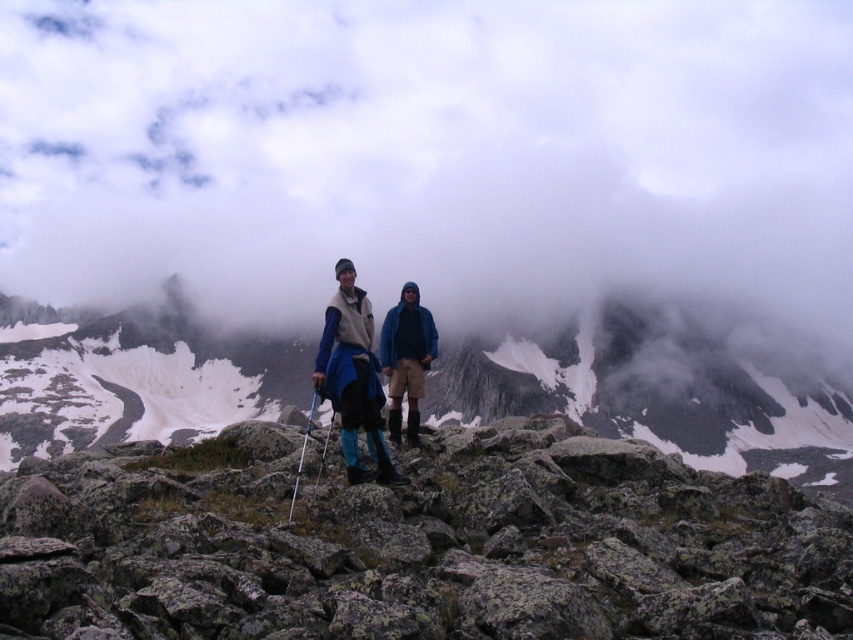
Question: Can you confirm if gray rock at center is smaller than rocky mountain at center?

Choices:
 (A) yes
 (B) no

Answer: (A)

Question: Is white fluffy cloud at upper center further to camera compared to blue fleece jacket at center?

Choices:
 (A) yes
 (B) no

Answer: (A)

Question: Which of these objects is positioned closest to the rocky mountain at center?

Choices:
 (A) gray rock at center
 (B) blue fleece jacket at center

Answer: (B)

Question: Which object is the closest to the rocky mountain at center?

Choices:
 (A) white fluffy cloud at upper center
 (B) blue fleece jacket at center

Answer: (A)

Question: Is rocky mountain at center further to camera compared to blue fleece jacket at center?

Choices:
 (A) no
 (B) yes

Answer: (B)

Question: Estimate the real-world distances between objects in this image. Which object is closer to the blue fleece jacket at center?

Choices:
 (A) gray rock at center
 (B) white fluffy cloud at upper center

Answer: (A)